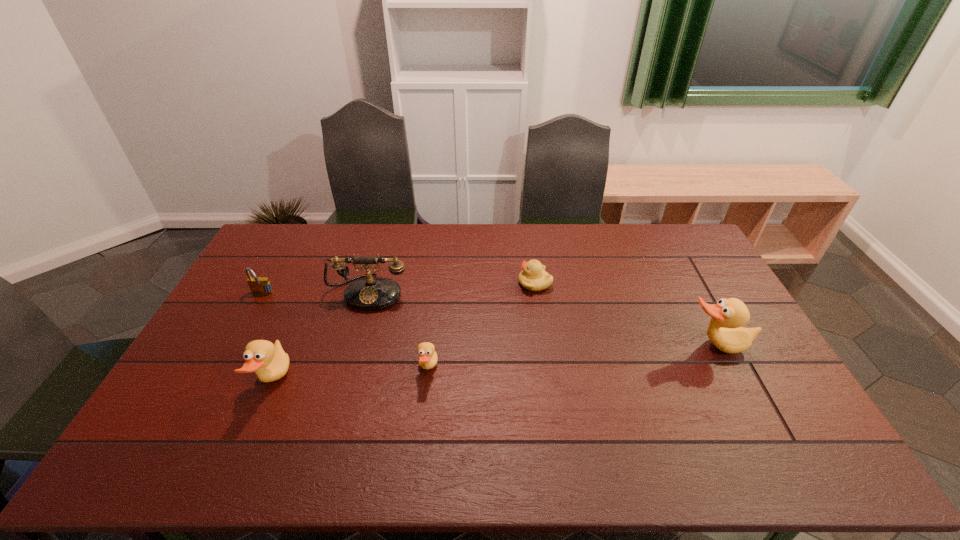
Locate an element on the screen. This screenshot has width=960, height=540. free space for an extra duck to achieve even spacing is located at coordinates (575, 357).